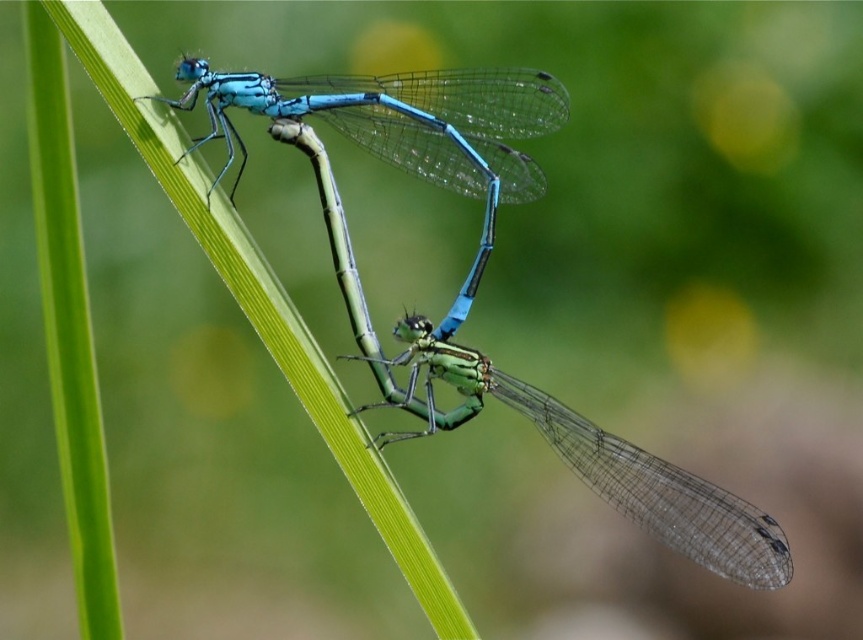
Question: Is translucent glass dragonfly at center wider than matte blue dragonfly at upper center?

Choices:
 (A) yes
 (B) no

Answer: (A)

Question: Observing the image, what is the correct spatial positioning of translucent glass dragonfly at center in reference to matte blue dragonfly at upper center?

Choices:
 (A) below
 (B) above

Answer: (A)

Question: Is translucent glass dragonfly at center closer to the viewer compared to matte blue dragonfly at upper center?

Choices:
 (A) yes
 (B) no

Answer: (B)